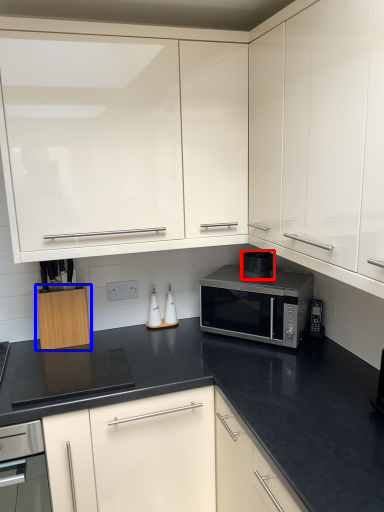
Question: Which object appears farthest to the camera in this image, appliance (highlighted by a red box) or cabinetry (highlighted by a blue box)?

Choices:
 (A) appliance
 (B) cabinetry

Answer: (A)